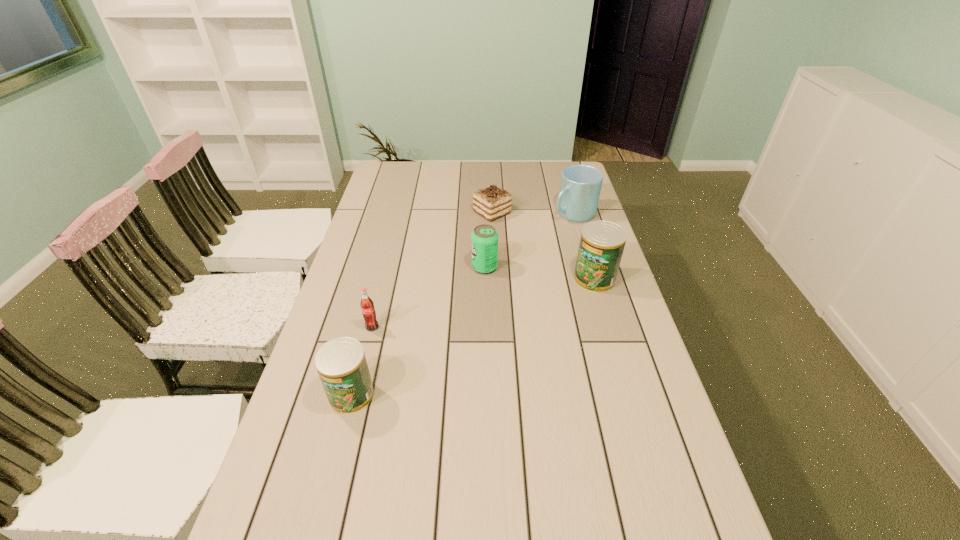
I want to click on vacant area between the nearer can and the chocolate cake, so click(x=421, y=303).

This screenshot has width=960, height=540. Find the location of `free space that is in between the left can and the farther soda bottle`. free space that is in between the left can and the farther soda bottle is located at coordinates (418, 331).

At what (x,y) coordinates should I click in order to perform the action: click on object that can be found as the fourth closest to the nearer can. Please return your answer as a coordinate pair (x, y). Looking at the image, I should click on (492, 202).

Select which object is the second closest to the chocolate cake. Please provide its 2D coordinates. Your answer should be formatted as a tuple, i.e. [(x, y)], where the tuple contains the x and y coordinates of a point satisfying the conditions above.

[(484, 240)]

Where is `free space that satisfies the following two spatial constraints: 1. on the front side of the mug; 2. on the left side of the right can`? free space that satisfies the following two spatial constraints: 1. on the front side of the mug; 2. on the left side of the right can is located at coordinates (592, 279).

Locate an element on the screen. vacant region that satisfies the following two spatial constraints: 1. on the back side of the right can; 2. on the front-facing side of the farther soda bottle is located at coordinates (591, 267).

I want to click on free location that satisfies the following two spatial constraints: 1. on the front-facing side of the right can; 2. on the right side of the farther soda bottle, so click(x=485, y=279).

This screenshot has width=960, height=540. In order to click on free location that satisfies the following two spatial constraints: 1. on the front side of the shortest object; 2. on the left side of the mug in this screenshot , I will do `click(492, 214)`.

Where is `free space that satisfies the following two spatial constraints: 1. on the front-facing side of the farther can; 2. on the left side of the right soda bottle`? free space that satisfies the following two spatial constraints: 1. on the front-facing side of the farther can; 2. on the left side of the right soda bottle is located at coordinates (485, 279).

Locate an element on the screen. This screenshot has width=960, height=540. free region that satisfies the following two spatial constraints: 1. on the front-facing side of the right can; 2. on the right side of the right soda bottle is located at coordinates (485, 279).